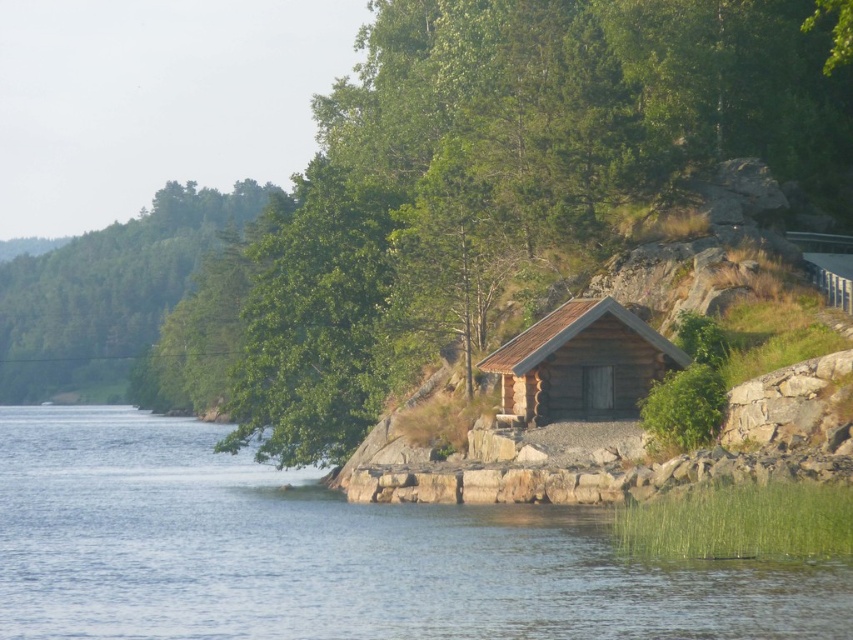
You are standing at the edge of the lake near the rustic wooden cabin. There are two points marked on the image. The first point is at coordinates point (325, 600) and the second point is at point (9, 259). Which point is closer to you?

Point (325, 600) is in front of point (9, 259), so it is closer to you.

You are standing at the point marked by the coordinates point (332, 554) in the image. What do you see around you according to the scene description?

You are standing in transparent blue water at lower left according to the scene description.